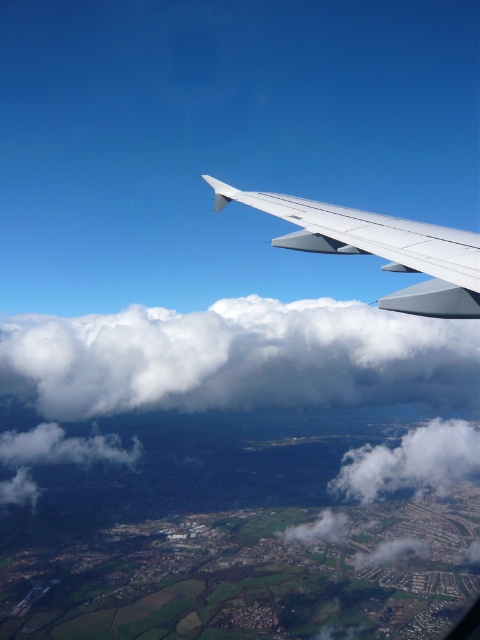
Measure the distance between white matte wing at upper center and white fluffy cloud at lower right.

A distance of 2008.39 feet exists between white matte wing at upper center and white fluffy cloud at lower right.

Does point (412, 252) lie behind point (381, 445)?

No.

In order to click on white matte wing at upper center in this screenshot , I will do `click(380, 248)`.

Who is positioned more to the left, white fluffy cloud at upper center or white matte wing at upper center?

From the viewer's perspective, white matte wing at upper center appears more on the left side.

Can you confirm if white fluffy cloud at upper center is thinner than white matte wing at upper center?

No, white fluffy cloud at upper center is not thinner than white matte wing at upper center.

Who is more forward, (x=124, y=348) or (x=303, y=209)?

Point (x=303, y=209) is more forward.

Where is `white fluffy cloud at upper center`? This screenshot has width=480, height=640. white fluffy cloud at upper center is located at coordinates (238, 358).

Which is more to the right, white fluffy cloud at upper center or white fluffy cloud at lower right?

white fluffy cloud at lower right is more to the right.

Can you confirm if white fluffy cloud at upper center is thinner than white fluffy cloud at lower right?

Incorrect, white fluffy cloud at upper center's width is not less than white fluffy cloud at lower right's.

Is point (283, 326) behind point (435, 436)?

No, it is not.

You are a GUI agent. You are given a task and a screenshot of the screen. Output one action in this format:
    pyautogui.click(x=<x>, y=<y>)
    Task: Click on the white fluffy cloud at upper center
    This screenshot has width=480, height=640.
    Given the screenshot: What is the action you would take?
    pyautogui.click(x=238, y=358)